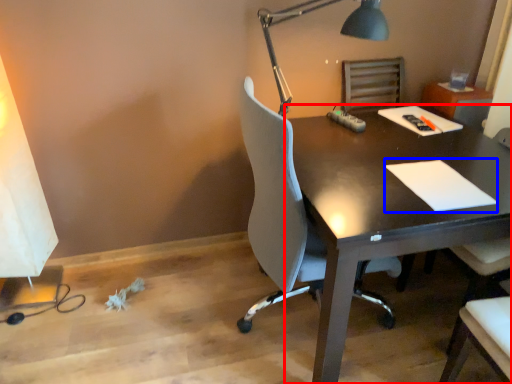
Question: Among these objects, which one is nearest to the camera, desk (highlighted by a red box) or notepad (highlighted by a blue box)?

Choices:
 (A) desk
 (B) notepad

Answer: (A)